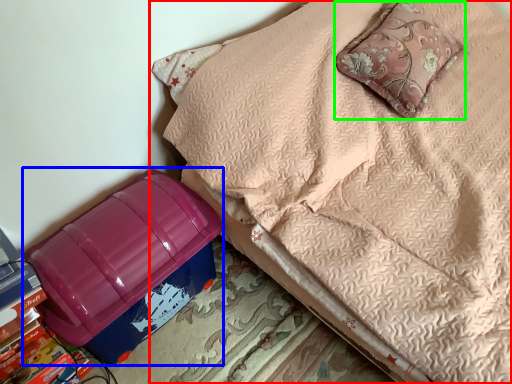
Question: Which is farther away from furniture (highlighted by a red box)? storage box (highlighted by a blue box) or pillow (highlighted by a green box)?

Choices:
 (A) storage box
 (B) pillow

Answer: (A)